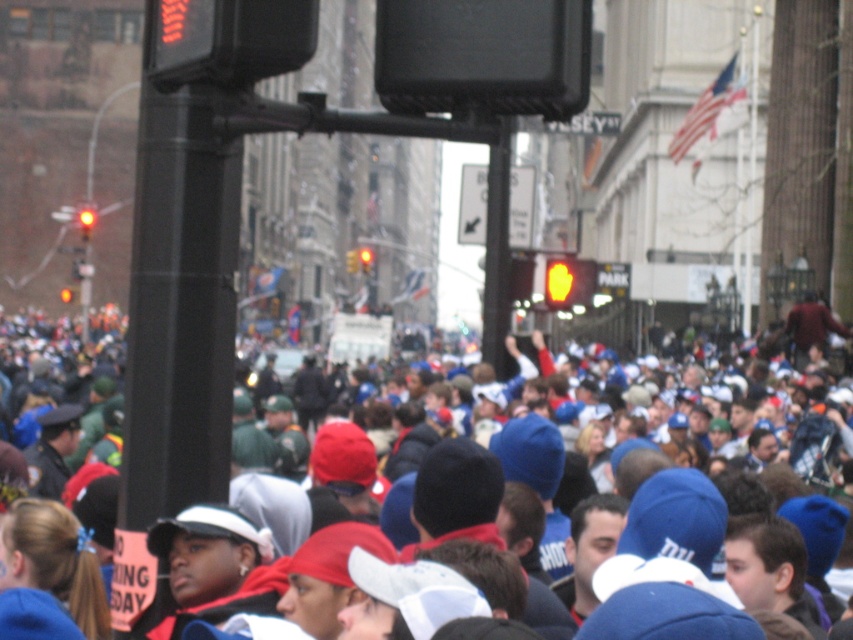
Is point (566, 298) positioned in front of point (363, 262)?

Yes.

Between yellow matte traffic light at center and amber glass traffic light at center, which one has less height?

Standing shorter between the two is yellow matte traffic light at center.

Is point (547, 268) positioned behind point (363, 248)?

No.

This screenshot has width=853, height=640. In order to click on yellow matte traffic light at center in this screenshot , I will do `click(560, 282)`.

Does blue fabric hats at center come behind yellow plastic traffic light at left?

No, it is not.

Does point (825, 608) come closer to viewer compared to point (70, 294)?

Yes.

Is point (759, 467) closer to camera compared to point (62, 289)?

Yes.

At what (x,y) coordinates should I click in order to perform the action: click on blue fabric hats at center. Please return your answer as a coordinate pair (x, y). Looking at the image, I should click on (700, 436).

Which is more to the left, black metal pole at center or red glass traffic light at center?

red glass traffic light at center

In the scene shown: Does black metal pole at center appear on the right side of red glass traffic light at center?

Indeed, black metal pole at center is positioned on the right side of red glass traffic light at center.

Is point (488, 339) farther from viewer compared to point (83, 211)?

No, it is in front of (83, 211).

The width and height of the screenshot is (853, 640). What are the coordinates of `black metal pole at center` in the screenshot? It's located at (496, 250).